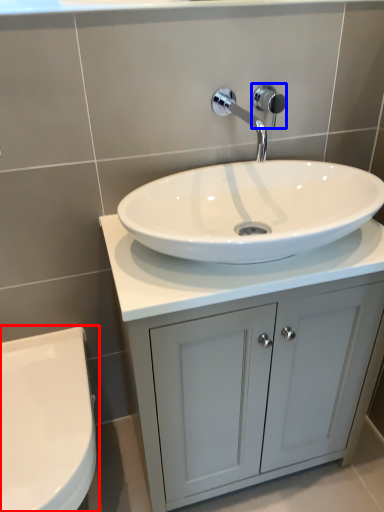
Question: Which point is further to the camera, toilet (highlighted by a red box) or shower (highlighted by a blue box)?

Choices:
 (A) toilet
 (B) shower

Answer: (B)